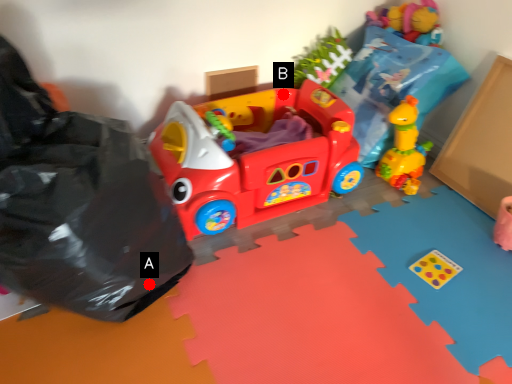
Question: Two points are circled on the image, labeled by A and B beside each circle. Which point is farther from the camera taking this photo?

Choices:
 (A) A is further
 (B) B is further

Answer: (B)